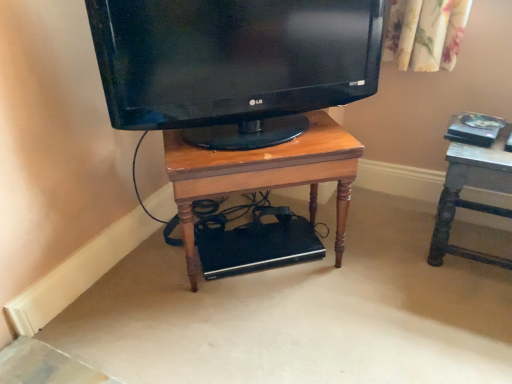
In order to click on free point to the left of wooden desk at center in this screenshot , I will do click(135, 284).